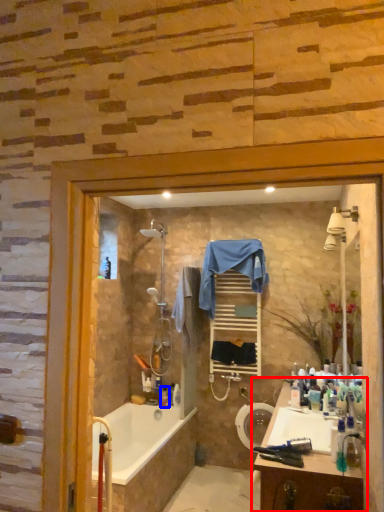
Question: Which object is further to the camera taking this photo, bathroom cabinet (highlighted by a red box) or toiletry (highlighted by a blue box)?

Choices:
 (A) bathroom cabinet
 (B) toiletry

Answer: (B)